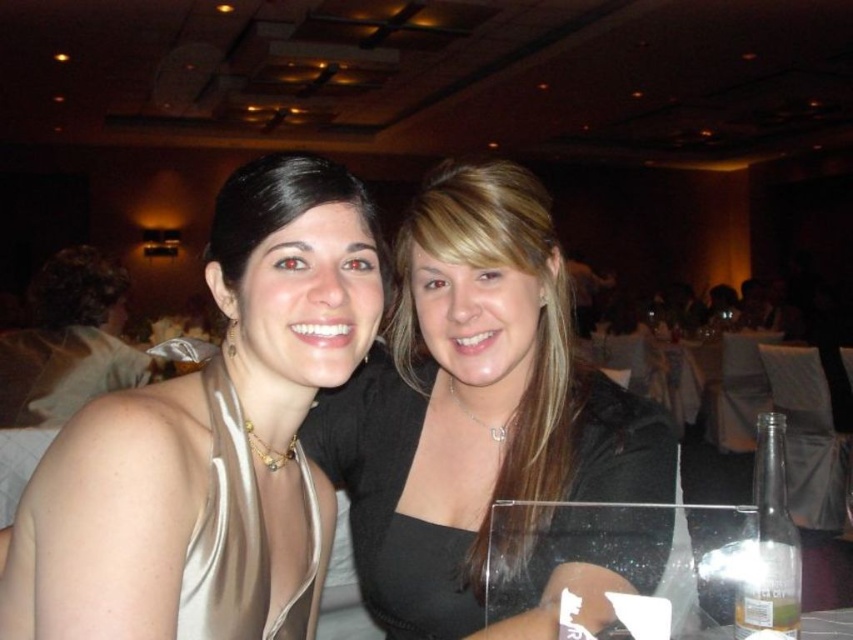
In the scene shown: You are a photographer standing 24 inches away from the satin scarf at center in the image. Can you adjust your position to get a closer shot of the scarf without moving the subjects?

The satin scarf at center is currently 23.79 inches away from the viewer. Since you are already positioned 24 inches away, you cannot move closer without exceeding the scarf distance. Therefore, you need to move slightly forward to get a closer shot.

You are a photographer at the event and want to ensure that both the satin scarf at center and the satin dress at center are visible in the photo. Given their positions, which one is closer to the camera?

The satin scarf at center is below the satin dress at center, so the satin dress at center is closer to the camera.

You are a photographer at this event and notice the satin scarf at center and the black satin blouse at center. Since you want to focus on the scarf, should you adjust your camera to capture it in front of the blouse?

Yes, the satin scarf at center is already positioned in front of the black satin blouse at center, so adjusting the camera to focus on the scarf will naturally place it in front of the blouse in the photo.